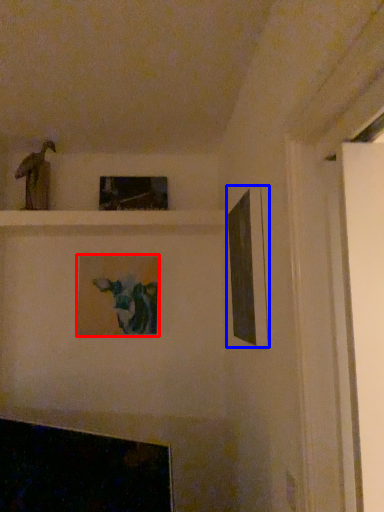
Question: Which point is further to the camera, picture frame (highlighted by a red box) or picture frame (highlighted by a blue box)?

Choices:
 (A) picture frame
 (B) picture frame

Answer: (A)